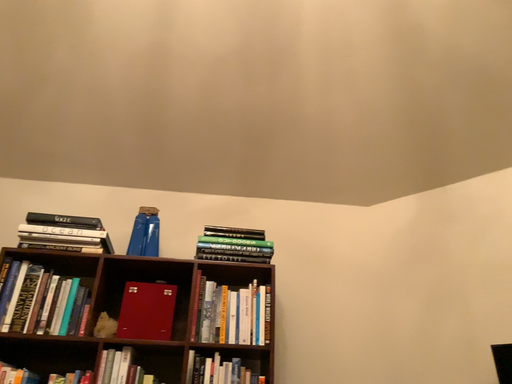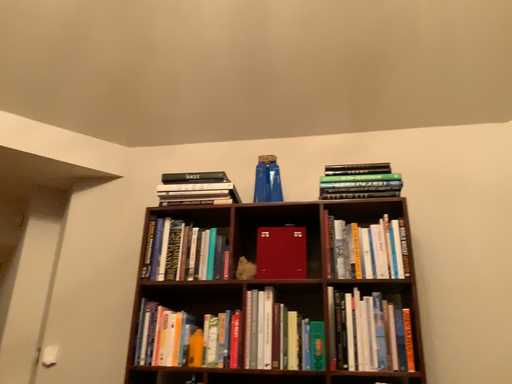
Question: How did the camera likely rotate when shooting the video?

Choices:
 (A) rotated upward
 (B) rotated downward

Answer: (B)